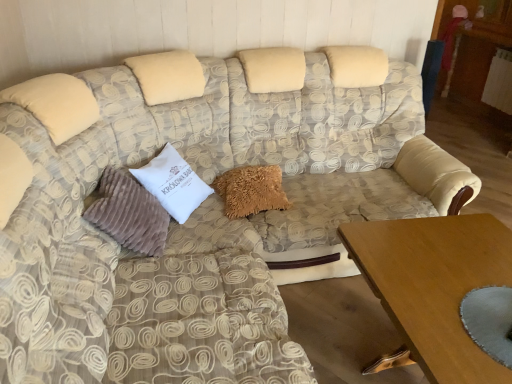
Question: From a real-world perspective, is white velvety pillow at center, which is counted as the second pillow, starting from the left, beneath wooden table at lower right?

Choices:
 (A) no
 (B) yes

Answer: (A)

Question: Is white velvety pillow at center, the 2th pillow in the right-to-left sequence, surrounding wooden table at lower right?

Choices:
 (A) no
 (B) yes

Answer: (A)

Question: Can you confirm if white velvety pillow at center, the 2th pillow in the right-to-left sequence, is thinner than wooden table at lower right?

Choices:
 (A) no
 (B) yes

Answer: (B)

Question: From the image's perspective, does white velvety pillow at center, which is counted as the second pillow, starting from the left, appear lower than wooden table at lower right?

Choices:
 (A) yes
 (B) no

Answer: (B)

Question: Can you confirm if white velvety pillow at center, the 2th pillow in the right-to-left sequence, is bigger than wooden table at lower right?

Choices:
 (A) no
 (B) yes

Answer: (A)

Question: Does white velvety pillow at center, the 2th pillow in the right-to-left sequence, have a lesser height compared to wooden table at lower right?

Choices:
 (A) yes
 (B) no

Answer: (A)

Question: From the image's perspective, is fuzzy beige pillow at center, the first pillow positioned from the right, above wooden table at lower right?

Choices:
 (A) no
 (B) yes

Answer: (B)

Question: Does fuzzy beige pillow at center, the first pillow positioned from the right, have a greater width compared to wooden table at lower right?

Choices:
 (A) yes
 (B) no

Answer: (B)

Question: Is fuzzy beige pillow at center, the first pillow positioned from the right, thinner than wooden table at lower right?

Choices:
 (A) yes
 (B) no

Answer: (A)

Question: Is fuzzy beige pillow at center, which appears as the 3th pillow when viewed from the left, not inside wooden table at lower right?

Choices:
 (A) no
 (B) yes

Answer: (B)

Question: Considering the relative sizes of fuzzy beige pillow at center, the first pillow positioned from the right, and wooden table at lower right in the image provided, is fuzzy beige pillow at center, the first pillow positioned from the right, smaller than wooden table at lower right?

Choices:
 (A) yes
 (B) no

Answer: (A)

Question: From a real-world perspective, is fuzzy beige pillow at center, the first pillow positioned from the right, under wooden table at lower right?

Choices:
 (A) no
 (B) yes

Answer: (A)

Question: Is suede-like beige pillow at left, acting as the 3th pillow starting from the right, facing away from fuzzy beige pillow at center, which appears as the 3th pillow when viewed from the left?

Choices:
 (A) no
 (B) yes

Answer: (A)